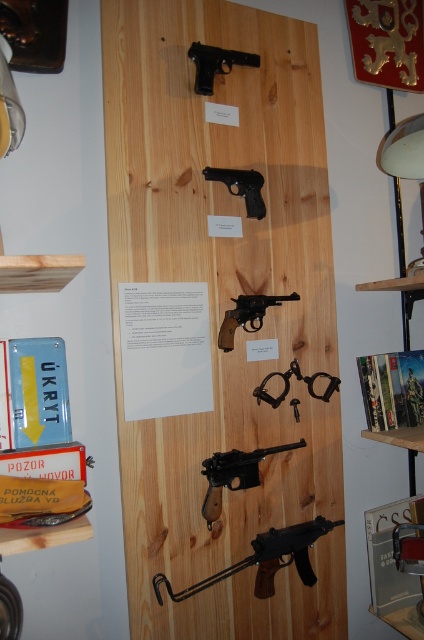
Based on the photo, you are a museum curator arranging the firearms display. You need to place a protective cover that is 12 inches wide over the black matte handgun at center and the matte black pistol at center. Based on their widths, will the cover fit both items without overlapping?

The black matte handgun at center might be wider than the matte black pistol at center. Since the protective cover is 12 inches wide, if the handgun is wider than the pistol and exceeds 12 inches, it may not fit. However, if both are within the 12 inches width, the cover could work. The exact fit depends on their actual widths which aren

You are an inspector examining the display panel. You notice two firearms labeled as black matte handgun at center and matte black pistol at center. Which one appears to be positioned in front of the other?

The black matte handgun at center is closer to the viewer than the matte black pistol at center, so it appears to be positioned in front of the matte black pistol at center.